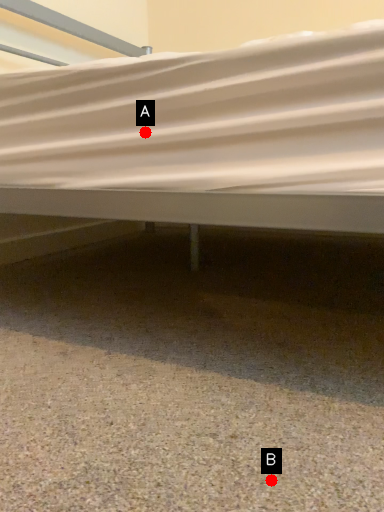
Question: Two points are circled on the image, labeled by A and B beside each circle. Which point is farther from the camera taking this photo?

Choices:
 (A) A is further
 (B) B is further

Answer: (A)